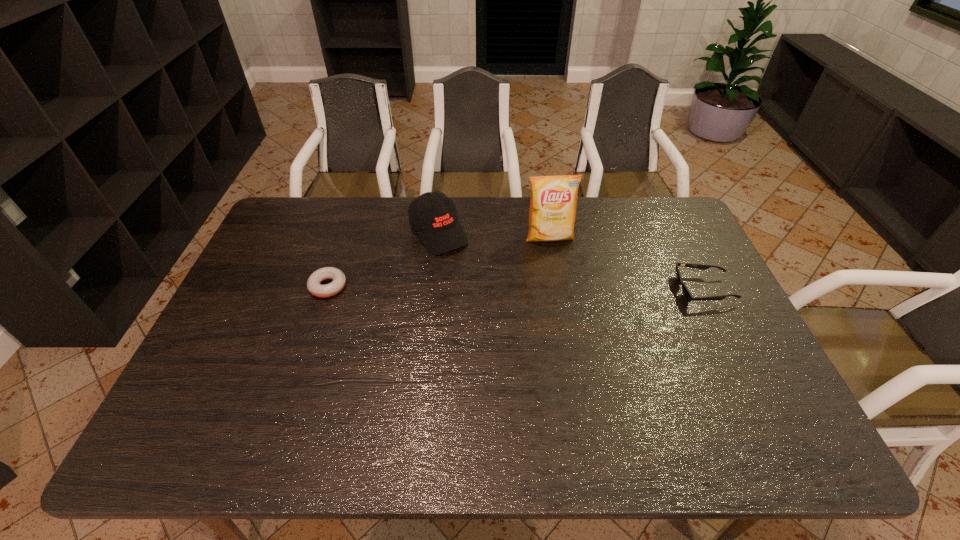
Identify the location of blank area in the image that satisfies the following two spatial constraints: 1. on the front side of the rightmost object; 2. on the front-facing side of the tallest object. The height and width of the screenshot is (540, 960). (559, 290).

Identify the location of vacant region that satisfies the following two spatial constraints: 1. on the front side of the shortest object; 2. on the front-facing side of the sunglasses. Image resolution: width=960 pixels, height=540 pixels. (327, 290).

Identify the location of free space in the image that satisfies the following two spatial constraints: 1. on the front side of the second tallest object; 2. on the left side of the tallest object. Image resolution: width=960 pixels, height=540 pixels. (438, 238).